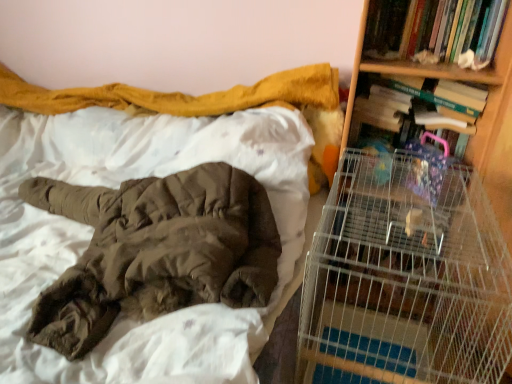
Question: Is the position of wooden bookshelf at right less distant than that of brown fuzzy blanket at upper left?

Choices:
 (A) yes
 (B) no

Answer: (B)

Question: From the image's perspective, would you say wooden bookshelf at right is positioned over brown fuzzy blanket at upper left?

Choices:
 (A) yes
 (B) no

Answer: (A)

Question: Is wooden bookshelf at right to the left of brown fuzzy blanket at upper left from the viewer's perspective?

Choices:
 (A) no
 (B) yes

Answer: (A)

Question: Is wooden bookshelf at right not close to brown fuzzy blanket at upper left?

Choices:
 (A) no
 (B) yes

Answer: (A)

Question: Would you say wooden bookshelf at right contains brown fuzzy blanket at upper left?

Choices:
 (A) no
 (B) yes

Answer: (A)

Question: Considering the relative positions of wooden bookshelf at right and brown fuzzy blanket at upper left in the image provided, is wooden bookshelf at right to the right of brown fuzzy blanket at upper left from the viewer's perspective?

Choices:
 (A) yes
 (B) no

Answer: (A)

Question: Considering the relative sizes of hardcover book at upper right, which is the first book in top-to-bottom order, and wooden bookshelf at right in the image provided, is hardcover book at upper right, which is the first book in top-to-bottom order, wider than wooden bookshelf at right?

Choices:
 (A) no
 (B) yes

Answer: (A)

Question: Is hardcover book at upper right, which is the first book in top-to-bottom order, aimed at wooden bookshelf at right?

Choices:
 (A) no
 (B) yes

Answer: (B)

Question: Is the position of hardcover book at upper right, which is the second book in bottom-to-top order, more distant than that of wooden bookshelf at right?

Choices:
 (A) no
 (B) yes

Answer: (B)

Question: Considering the relative positions of hardcover book at upper right, which is the second book in bottom-to-top order, and wooden bookshelf at right in the image provided, is hardcover book at upper right, which is the second book in bottom-to-top order, to the left of wooden bookshelf at right from the viewer's perspective?

Choices:
 (A) no
 (B) yes

Answer: (A)

Question: Can you confirm if hardcover book at upper right, which is the first book in top-to-bottom order, is bigger than wooden bookshelf at right?

Choices:
 (A) yes
 (B) no

Answer: (B)

Question: Is hardcover book at upper right, which is the first book in top-to-bottom order, taller than wooden bookshelf at right?

Choices:
 (A) yes
 (B) no

Answer: (B)

Question: From a real-world perspective, is hardcover book at upper right, which is the first book in top-to-bottom order, physically below brown fuzzy blanket at upper left?

Choices:
 (A) no
 (B) yes

Answer: (A)